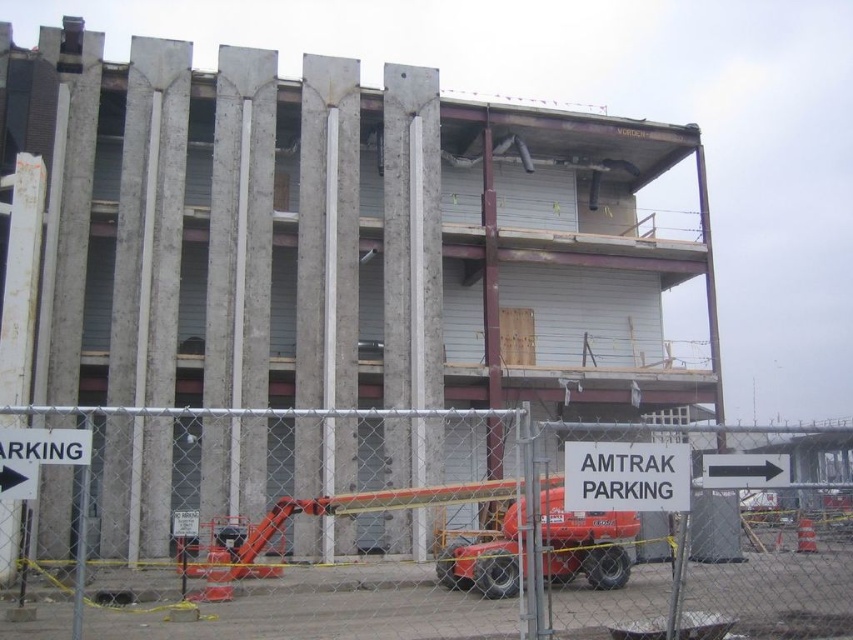
Is white plastic sign at center in front of black arrow at right?

Yes, white plastic sign at center is in front of black arrow at right.

Who is positioned more to the right, white plastic sign at center or black arrow at right?

Positioned to the right is black arrow at right.

The width and height of the screenshot is (853, 640). What do you see at coordinates (625, 476) in the screenshot? I see `white plastic sign at center` at bounding box center [625, 476].

The image size is (853, 640). Find the location of `white plastic sign at center`. white plastic sign at center is located at coordinates (625, 476).

Is point (688, 518) farther from camera compared to point (775, 477)?

Yes, it is.

Who is more forward, (x=282, y=586) or (x=786, y=452)?

Point (x=282, y=586) is more forward.

Locate an element on the screen. The image size is (853, 640). orange rubber lift at lower center is located at coordinates (421, 538).

Is orange rubber lift at lower center taller than white plastic sign at center?

Indeed, orange rubber lift at lower center has a greater height compared to white plastic sign at center.

Can you confirm if orange rubber lift at lower center is wider than white plastic sign at center?

Yes.

This screenshot has width=853, height=640. What do you see at coordinates (421, 538) in the screenshot?
I see `orange rubber lift at lower center` at bounding box center [421, 538].

Where is `orange rubber lift at lower center`? orange rubber lift at lower center is located at coordinates (421, 538).